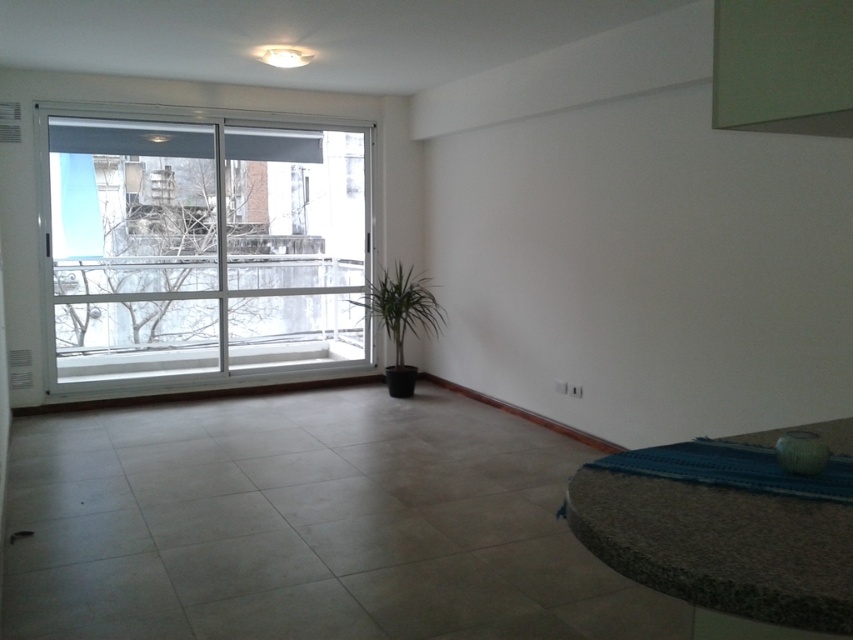
You are standing in the living room and want to water the green matte plant at center. To reach the water source, you need to walk past the white plastic window at left. Is the window above or below the plant?

The white plastic window at left is located above the green matte plant at center, so the window is above the plant.

You are standing in the living room and want to move from point A to point B. Point A is at coordinates point [289,138] and point B is at coordinates point [401,342]. Which point is closer to you?

Point [289,138] is closer to you because it is further to the camera than point [401,342].